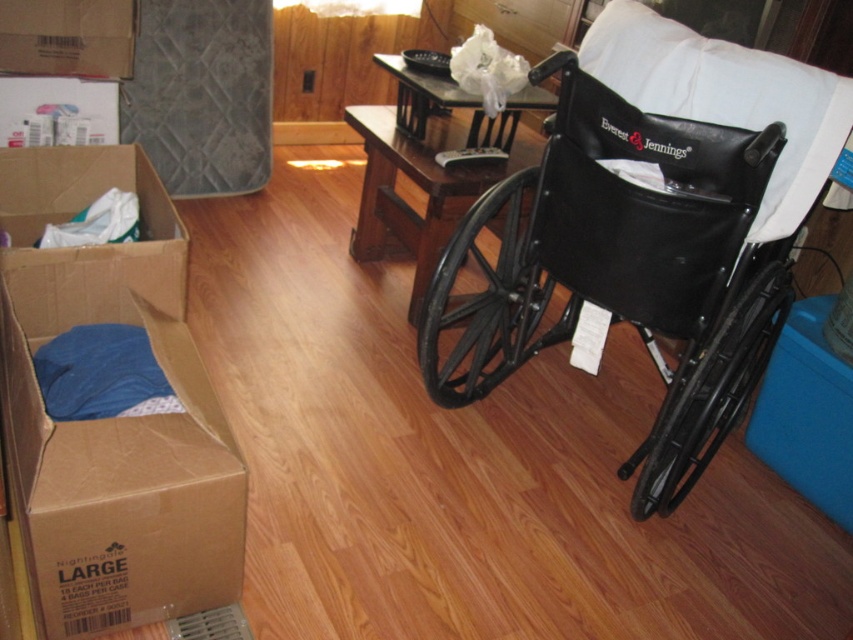
You are moving into a new apartment and need to place the dark gray quilted mattress at left and the brown cardboard box at upper left in your bedroom. Based on their sizes, which object should you place first if you want to maximize the available floor space?

The dark gray quilted mattress at left is taller than the brown cardboard box at upper left, so you should place the brown cardboard box at upper left first to maximize floor space since it takes up less vertical space.

You are a caregiver assisting a patient who needs to move from the wheelchair to the bed. The bed is located behind the brown cardboard box at upper left. Can you safely move the black plastic wheelchair at right to access the bed without disturbing the box?

The black plastic wheelchair at right is positioned under the brown cardboard box at upper left, so moving the wheelchair might risk knocking over the box. Ensure the box is secured before moving the wheelchair to access the bed safely.